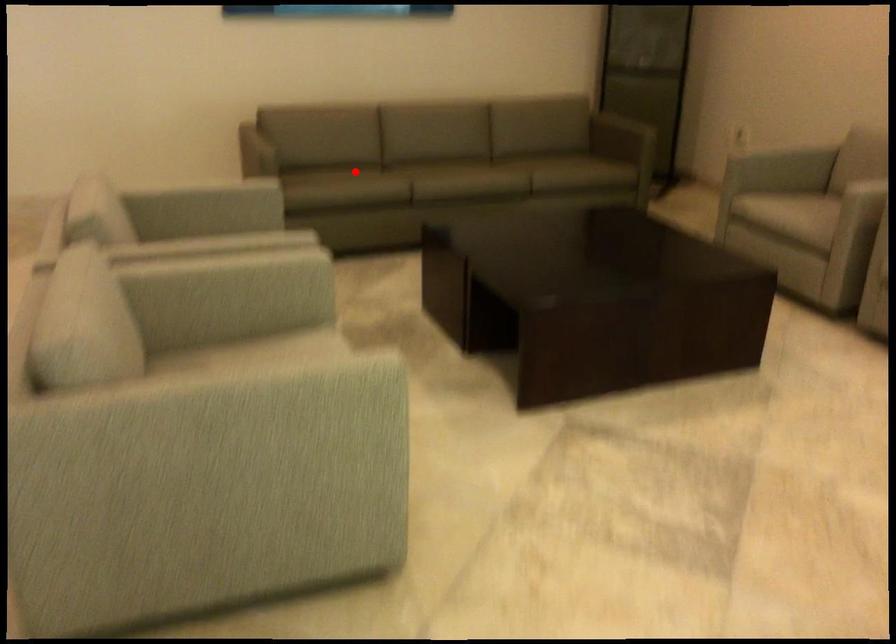
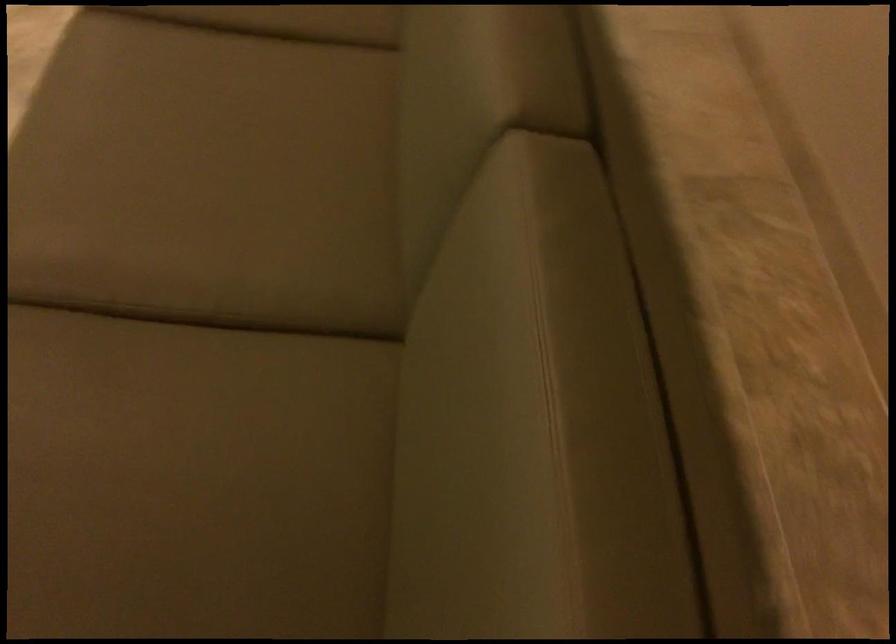
The point at the highlighted location is marked in the first image. Where is the corresponding point in the second image?

(286, 20)